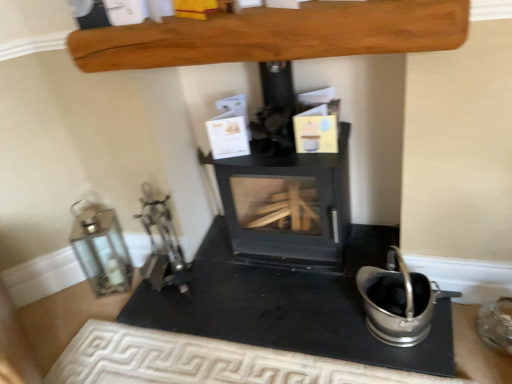
Question: Does black matte wood burning stove at center have a greater height compared to satin silver bucket at lower right, acting as the second appliance starting from the right?

Choices:
 (A) no
 (B) yes

Answer: (B)

Question: Is black matte wood burning stove at center to the right of satin silver bucket at lower right, acting as the 2th appliance starting from the left, from the viewer's perspective?

Choices:
 (A) no
 (B) yes

Answer: (A)

Question: Considering the relative sizes of black matte wood burning stove at center and satin silver bucket at lower right, acting as the 2th appliance starting from the left, in the image provided, is black matte wood burning stove at center bigger than satin silver bucket at lower right, acting as the 2th appliance starting from the left,?

Choices:
 (A) no
 (B) yes

Answer: (B)

Question: Could you tell me if black matte wood burning stove at center is facing satin silver bucket at lower right, acting as the 2th appliance starting from the left?

Choices:
 (A) yes
 (B) no

Answer: (B)

Question: Does black matte wood burning stove at center appear on the left side of satin silver bucket at lower right, acting as the 2th appliance starting from the left?

Choices:
 (A) no
 (B) yes

Answer: (B)

Question: From their relative heights in the image, would you say satin silver bucket at lower right, acting as the second appliance starting from the right, is taller or shorter than silver metallic lantern at left, the 3th appliance positioned from the right?

Choices:
 (A) tall
 (B) short

Answer: (B)

Question: Which is correct: satin silver bucket at lower right, acting as the 2th appliance starting from the left, is inside silver metallic lantern at left, the 3th appliance positioned from the right, or outside of it?

Choices:
 (A) outside
 (B) inside

Answer: (A)

Question: Is point (385, 309) closer or farther from the camera than point (109, 216)?

Choices:
 (A) farther
 (B) closer

Answer: (B)

Question: In the image, is satin silver bucket at lower right, acting as the 2th appliance starting from the left, positioned in front of or behind silver metallic lantern at left, the 3th appliance positioned from the right?

Choices:
 (A) front
 (B) behind

Answer: (A)

Question: In terms of height, does black matte wood burning stove at center look taller or shorter compared to silver metallic lantern at left, the 3th appliance positioned from the right?

Choices:
 (A) tall
 (B) short

Answer: (A)

Question: Choose the correct answer: Is black matte wood burning stove at center inside silver metallic lantern at left, acting as the 1th appliance starting from the left, or outside it?

Choices:
 (A) outside
 (B) inside

Answer: (A)

Question: From a real-world perspective, is black matte wood burning stove at center positioned above or below silver metallic lantern at left, the 3th appliance positioned from the right?

Choices:
 (A) below
 (B) above

Answer: (B)

Question: From the image's perspective, is black matte wood burning stove at center above or below silver metallic lantern at left, the 3th appliance positioned from the right?

Choices:
 (A) above
 (B) below

Answer: (A)

Question: Which is correct: silver metallic lantern at left, acting as the 1th appliance starting from the left, is inside transparent glass jar at lower right, positioned as the third appliance in left-to-right order, or outside of it?

Choices:
 (A) outside
 (B) inside

Answer: (A)

Question: From a real-world perspective, is silver metallic lantern at left, the 3th appliance positioned from the right, positioned above or below transparent glass jar at lower right, the 1th appliance in the right-to-left sequence?

Choices:
 (A) above
 (B) below

Answer: (A)